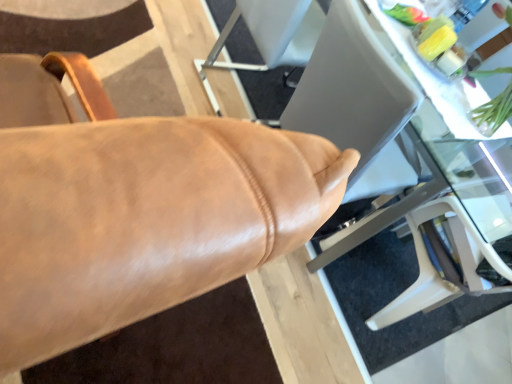
Question: Is transparent glass table at center situated inside leather chair at center or outside?

Choices:
 (A) outside
 (B) inside

Answer: (A)

Question: From the image's perspective, relative to leather chair at center, is transparent glass table at center above or below?

Choices:
 (A) above
 (B) below

Answer: (A)

Question: Which is farther from the transparent glass table at center?

Choices:
 (A) leather chair at center
 (B) green leafy plant at upper right

Answer: (A)

Question: Which object is the closest to the leather chair at center?

Choices:
 (A) green leafy plant at upper right
 (B) transparent glass table at center

Answer: (B)